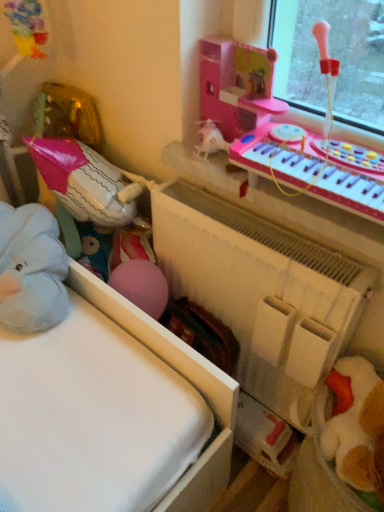
Question: In terms of height, does white matte radiator at center look taller or shorter compared to pink plastic musical keyboard at upper right?

Choices:
 (A) short
 (B) tall

Answer: (B)

Question: Is white matte radiator at center situated inside pink plastic musical keyboard at upper right or outside?

Choices:
 (A) outside
 (B) inside

Answer: (A)

Question: From a real-world perspective, relative to pink plastic musical keyboard at upper right, is white matte radiator at center vertically above or below?

Choices:
 (A) below
 (B) above

Answer: (A)

Question: Is point (244, 163) positioned closer to the camera than point (360, 295)?

Choices:
 (A) closer
 (B) farther

Answer: (B)

Question: Is pink plastic musical keyboard at upper right inside the boundaries of white matte radiator at center, or outside?

Choices:
 (A) inside
 (B) outside

Answer: (B)

Question: Is pink plastic musical keyboard at upper right wider or thinner than white matte radiator at center?

Choices:
 (A) thin
 (B) wide

Answer: (B)

Question: From the image's perspective, is pink plastic musical keyboard at upper right located above or below white matte radiator at center?

Choices:
 (A) above
 (B) below

Answer: (A)